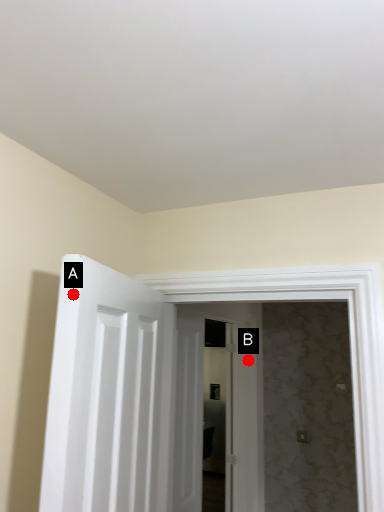
Question: Two points are circled on the image, labeled by A and B beside each circle. Which point appears farthest from the camera in this image?

Choices:
 (A) A is further
 (B) B is further

Answer: (B)